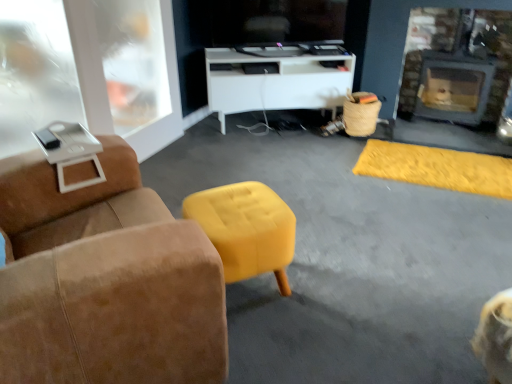
Identify the location of vacant space to the left of yellow fabric ottoman at center. This screenshot has height=384, width=512. (336, 184).